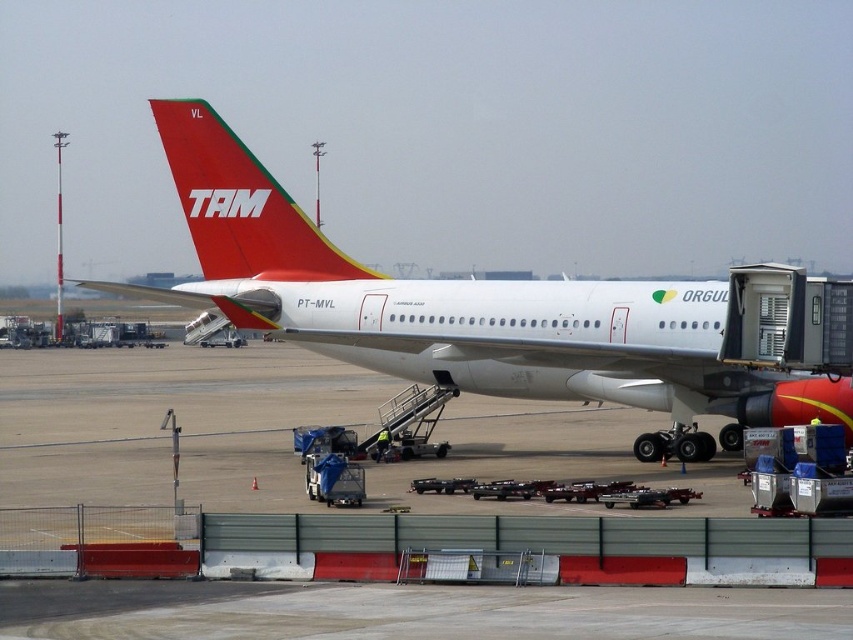
Can you confirm if white glossy airplane at center is bigger than matte red airplane tail at upper center?

Correct, white glossy airplane at center is larger in size than matte red airplane tail at upper center.

From the picture: Is white glossy airplane at center thinner than matte red airplane tail at upper center?

Incorrect, white glossy airplane at center's width is not less than matte red airplane tail at upper center's.

Does point (239, 307) lie in front of point (241, 188)?

Yes, point (239, 307) is in front of point (241, 188).

In order to click on white glossy airplane at center in this screenshot , I will do `click(459, 307)`.